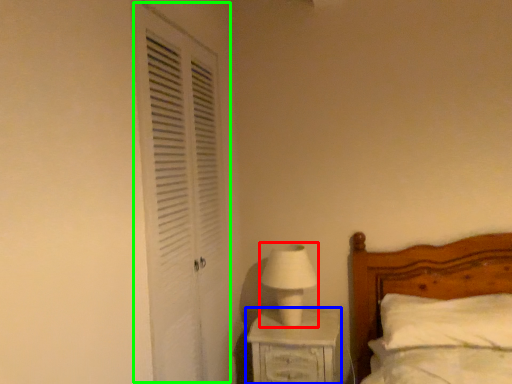
Question: Estimate the real-world distances between objects in this image. Which object is farther from table lamp (highlighted by a red box), nightstand (highlighted by a blue box) or screen door (highlighted by a green box)?

Choices:
 (A) nightstand
 (B) screen door

Answer: (B)